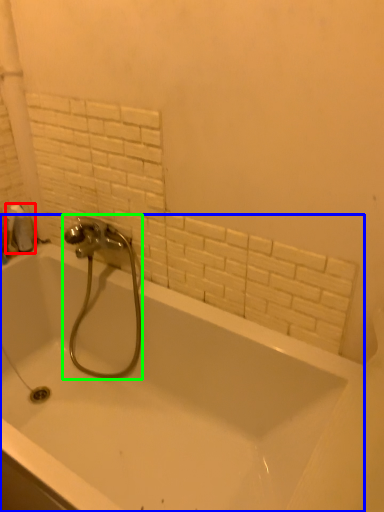
Question: Which object is positioned farthest from toilet paper (highlighted by a red box)? Select from bathtub (highlighted by a blue box) and tap (highlighted by a green box).

Choices:
 (A) bathtub
 (B) tap

Answer: (A)